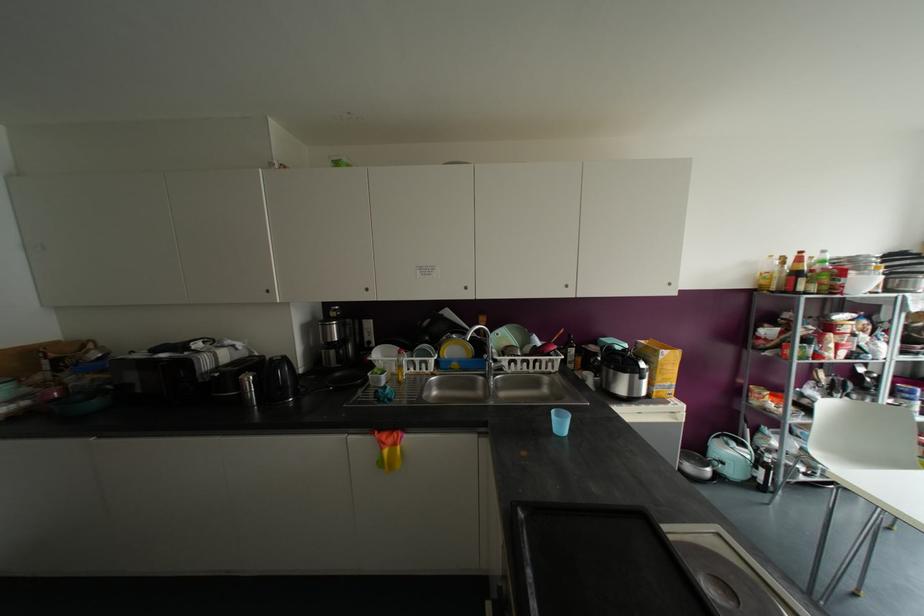
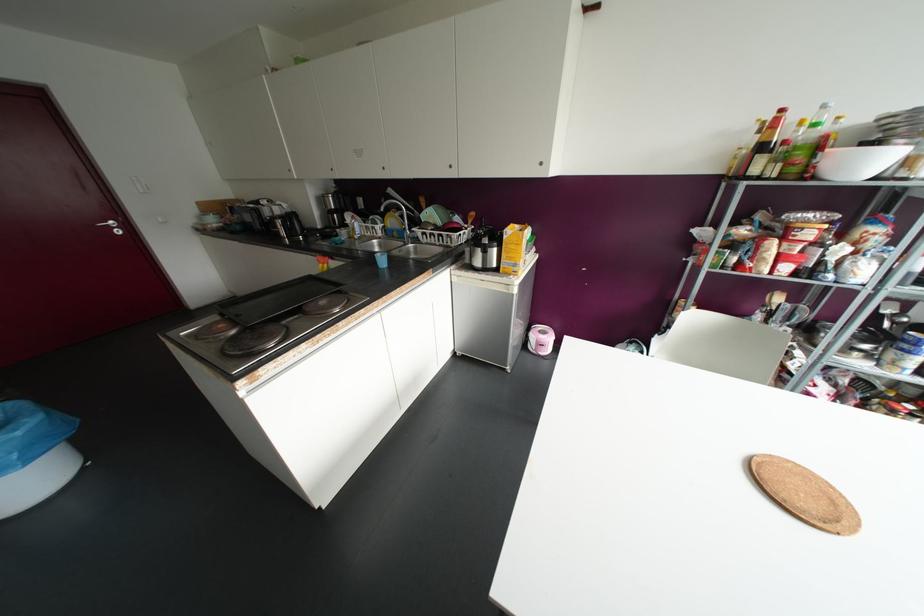
Where in the second image is the point corresponding to point (822, 251) from the first image?

(823, 106)